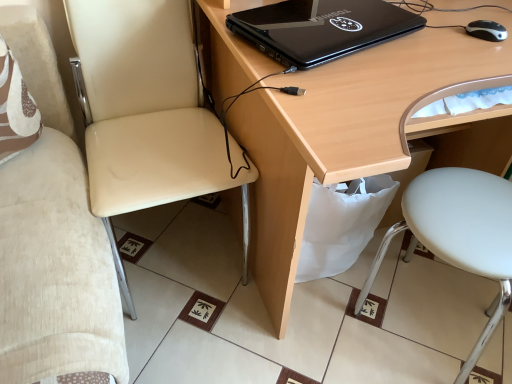
Question: In terms of width, does light wood desk at center look wider or thinner when compared to black matte laptop at upper center?

Choices:
 (A) wide
 (B) thin

Answer: (A)

Question: Is light wood desk at center to the left or to the right of black matte laptop at upper center in the image?

Choices:
 (A) right
 (B) left

Answer: (A)

Question: Estimate the real-world distances between objects in this image. Which object is farther from the black plastic mouse at right?

Choices:
 (A) white matte stool at lower right, which is the 2th chair from left to right
 (B) black matte laptop at upper center
 (C) light wood desk at center
 (D) beige leather chair at left, which is the 2th chair in right-to-left order

Answer: (D)

Question: Based on their relative distances, which object is farther from the beige leather chair at left, which is the 2th chair in right-to-left order?

Choices:
 (A) black matte laptop at upper center
 (B) black plastic mouse at right
 (C) light wood desk at center
 (D) white matte stool at lower right, which is the 2th chair from left to right

Answer: (B)